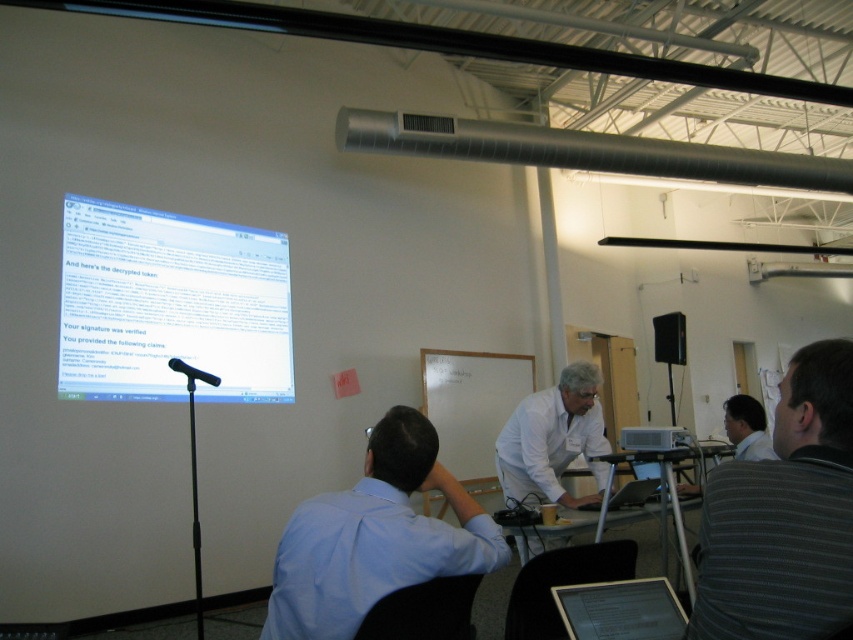
In the scene shown: You are attending a presentation in the workshop and need to check your notes on the laptop. The gray striped shirt at upper right is blocking your view of the silver metallic laptop at center. Can you move around to see the laptop screen clearly?

The gray striped shirt at upper right is located above the silver metallic laptop at center, so moving to the side or below the laptop might allow you to see the screen without obstruction.

You are a presenter standing at the front of the room near the white plastic projector at center. You want to hand out a document to the person wearing the gray striped shirt at upper right. If you walk directly towards them, how far will you have to walk to reach them?

The distance of gray striped shirt at upper right from white plastic projector at center is 1.75 meters, so you will have to walk 1.75 meters to reach them.